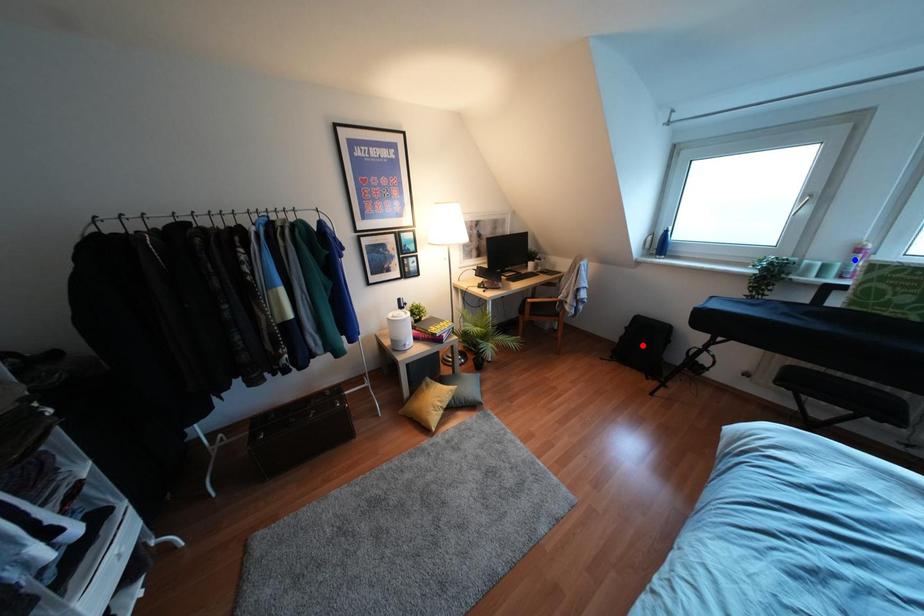
Question: Which of the two points in the image is closer to the camera?

Choices:
 (A) Blue point is closer.
 (B) Red point is closer.

Answer: (A)